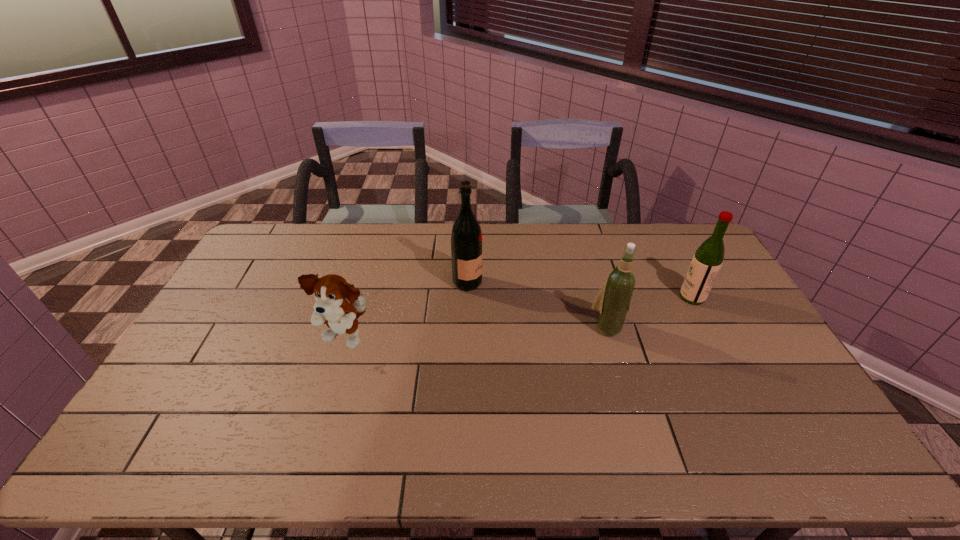
At what (x,y) coordinates should I click in order to perform the action: click on blank area located on the label of the shorter liquor. Please return your answer as a coordinate pair (x, y). Image resolution: width=960 pixels, height=540 pixels. Looking at the image, I should click on (580, 297).

This screenshot has height=540, width=960. I want to click on free space located 0.210m on the front-facing side of the wine bottle, so click(x=629, y=400).

Find the location of a particular element. The width and height of the screenshot is (960, 540). free space located on the face of the puppy is located at coordinates (332, 384).

At what (x,y) coordinates should I click in order to perform the action: click on object that is at the right edge. Please return your answer as a coordinate pair (x, y). Looking at the image, I should click on (708, 258).

In the image, there is a desktop. In order to click on blank space at the far edge in this screenshot , I will do `click(506, 230)`.

Locate an element on the screen. The image size is (960, 540). vacant space at the near edge of the desktop is located at coordinates (625, 448).

In order to click on blank space at the left edge of the desktop in this screenshot , I will do `click(159, 414)`.

Image resolution: width=960 pixels, height=540 pixels. Identify the location of free space at the right edge of the desktop. pos(673,264).

The height and width of the screenshot is (540, 960). In order to click on free space at the far left corner of the desktop in this screenshot , I will do `click(291, 245)`.

This screenshot has width=960, height=540. I want to click on empty space between the taller liquor and the wine bottle, so [538, 305].